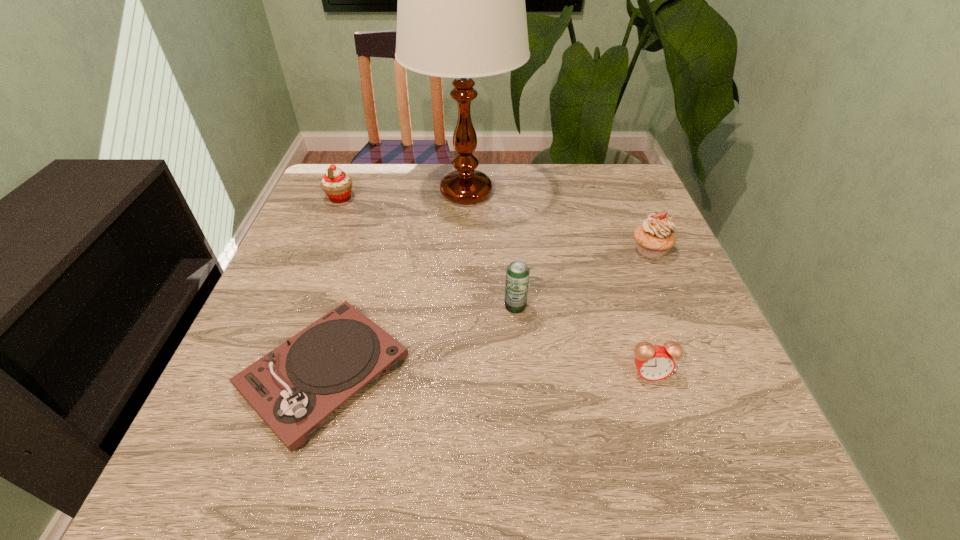
The width and height of the screenshot is (960, 540). In order to click on blank space located on the front of the nearer cupcake in this screenshot , I will do `click(719, 413)`.

Locate an element on the screen. free space located 0.070m on the clock face of the second object from right to left is located at coordinates (664, 418).

Identify the location of vacant space located on the right of the shortest object. (499, 373).

Image resolution: width=960 pixels, height=540 pixels. What are the coordinates of `table lamp present at the far edge` in the screenshot? It's located at (461, 13).

At what (x,y) coordinates should I click in order to perform the action: click on cupcake at the far edge. Please return your answer as a coordinate pair (x, y). Looking at the image, I should click on (337, 185).

Where is `object present at the near edge`? object present at the near edge is located at coordinates (293, 388).

Identify the location of cupcake positioned at the left edge. This screenshot has height=540, width=960. (337, 185).

This screenshot has height=540, width=960. In order to click on phonograph_record that is at the left edge in this screenshot , I will do `click(293, 388)`.

At what (x,y) coordinates should I click in order to perform the action: click on cupcake that is at the right edge. Please return your answer as a coordinate pair (x, y). Image resolution: width=960 pixels, height=540 pixels. Looking at the image, I should click on (654, 237).

The width and height of the screenshot is (960, 540). What are the coordinates of `alarm clock that is at the right edge` in the screenshot? It's located at click(x=654, y=362).